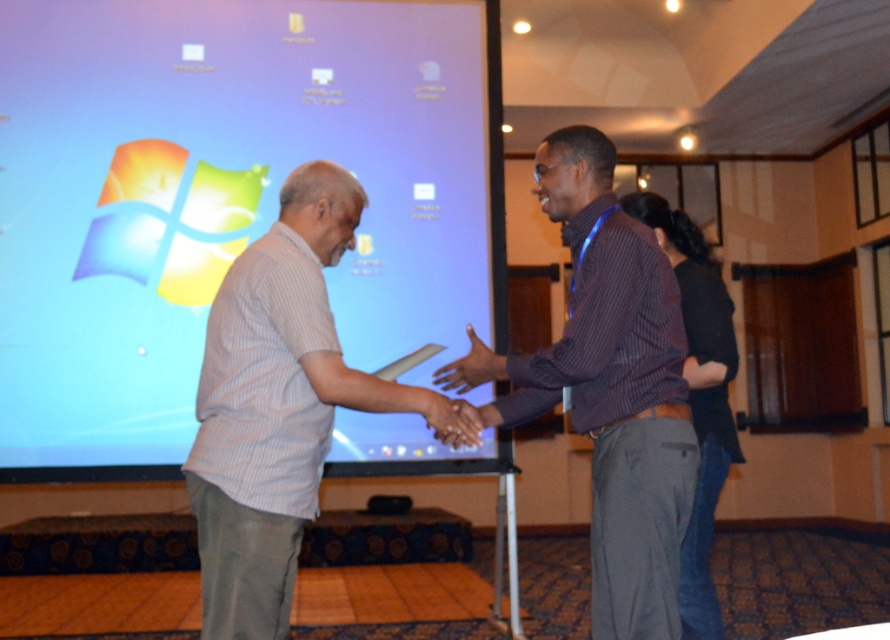
Question: Among these objects, which one is nearest to the camera?

Choices:
 (A) striped cotton shirt at center
 (B) smooth skin handshake at center

Answer: (A)

Question: Is blue glossy projection screen at upper left to the left of smooth skin handshake at center from the viewer's perspective?

Choices:
 (A) yes
 (B) no

Answer: (A)

Question: Can you confirm if striped cotton shirt at center is wider than matte black hand at center?

Choices:
 (A) yes
 (B) no

Answer: (A)

Question: Which object is farther from the camera taking this photo?

Choices:
 (A) matte black hand at center
 (B) purple striped shirt at center
 (C) white striped shirt at left

Answer: (A)

Question: Can you confirm if blue glossy projection screen at upper left is thinner than white striped shirt at left?

Choices:
 (A) no
 (B) yes

Answer: (A)

Question: Which point is farther to the camera?

Choices:
 (A) (697, 634)
 (B) (53, 116)

Answer: (B)